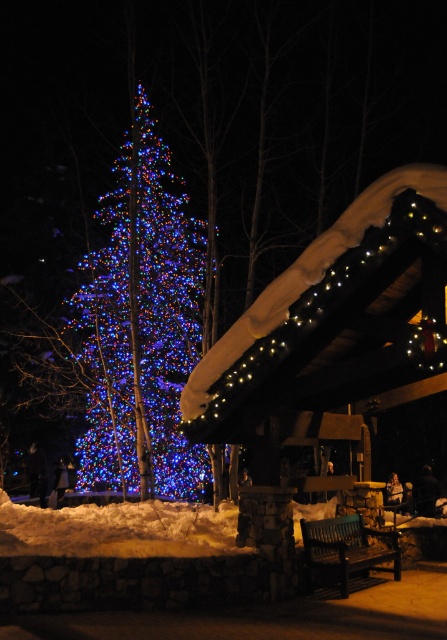
Question: Is illuminated plastic christmas tree at left wider than dark wood bench at center?

Choices:
 (A) no
 (B) yes

Answer: (B)

Question: Which point is closer to the camera taking this photo?

Choices:
 (A) (146, 236)
 (B) (379, 540)

Answer: (B)

Question: Is illuminated plastic christmas tree at left positioned behind dark wood bench at center?

Choices:
 (A) yes
 (B) no

Answer: (A)

Question: Which point appears farthest from the camera in this image?

Choices:
 (A) (150, 156)
 (B) (313, 545)

Answer: (A)

Question: Is illuminated plastic christmas tree at left wider than dark wood bench at center?

Choices:
 (A) no
 (B) yes

Answer: (B)